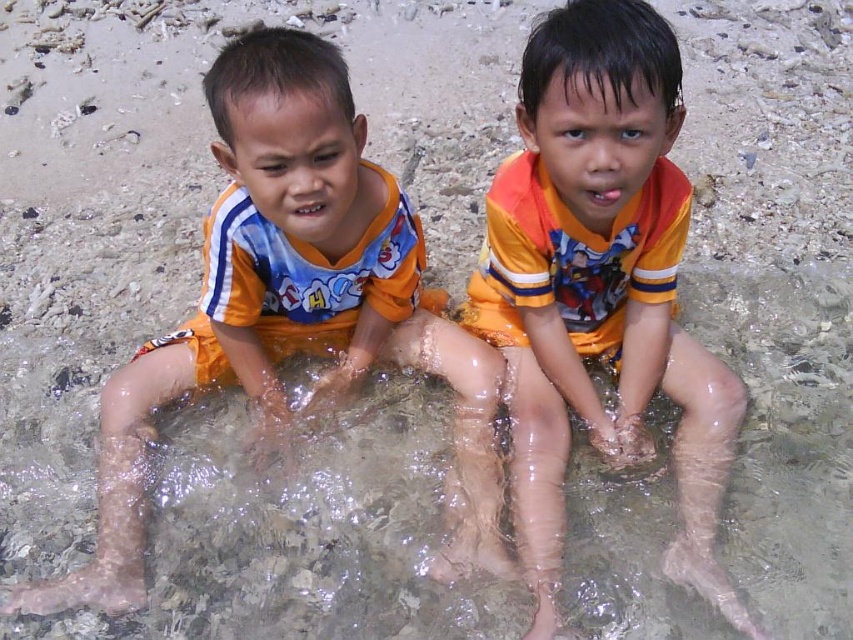
You are a lifeguard on duty and need to assess the water depth near the children. The safety guideline states that the water should not exceed 0.5 meters in depth for children in this area. Can you determine if the clear water at legs center meets this safety requirement based on its location coordinates?

The clear water at legs center is located at point (300, 532). Since the coordinates do not provide depth information, the lifeguard cannot determine the water depth solely based on location. Additional measurements are needed to ensure compliance with safety guidelines.

You are a photographer trying to capture a clear shot of the orange cotton shirt at center. However, there is clear water at legs center in the way. Can you adjust your position to take the photo without the water obstructing the shirt?

The orange cotton shirt at center is behind the clear water at legs center, so you can adjust your position slightly to angle the camera around the water to capture the shirt without obstruction.

You are standing at the origin point in the image and want to reach the point marked as point (474, 586). Which direction should you move relative to point (602, 198)?

You should move behind point (602, 198) to reach point (474, 586) because point (474, 586) is located behind point (602, 198) according to the spatial description.